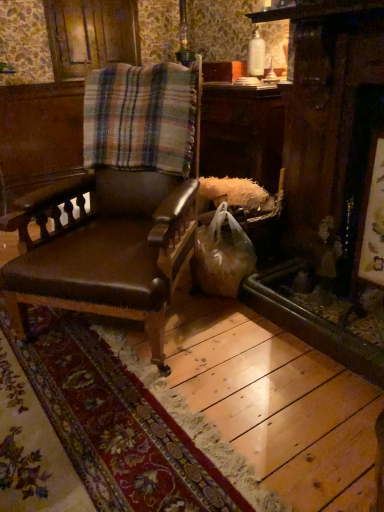
Locate an element on the screen. The width and height of the screenshot is (384, 512). free point to the left of translucent plastic bag at lower right is located at coordinates (187, 301).